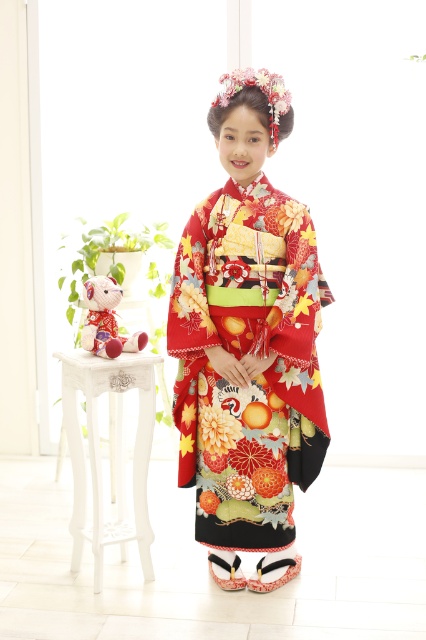
Question: Considering the relative positions of floral silk kimono at center and velvet plush bear at left in the image provided, where is floral silk kimono at center located with respect to velvet plush bear at left?

Choices:
 (A) below
 (B) above

Answer: (A)

Question: Observing the image, what is the correct spatial positioning of floral silk kimono at center in reference to white wood stool at left?

Choices:
 (A) below
 (B) above

Answer: (B)

Question: Among these objects, which one is farthest from the camera?

Choices:
 (A) floral silk kimono at center
 (B) white wood stool at left

Answer: (B)

Question: Which object is positioned closest to the white wood stool at left?

Choices:
 (A) velvet plush bear at left
 (B) floral silk kimono at center

Answer: (A)

Question: Which point is farther from the camera taking this photo?

Choices:
 (A) (83, 346)
 (B) (238, 268)
 (C) (80, 364)

Answer: (A)

Question: Where is floral silk kimono at center located in relation to white wood stool at left in the image?

Choices:
 (A) left
 (B) right

Answer: (B)